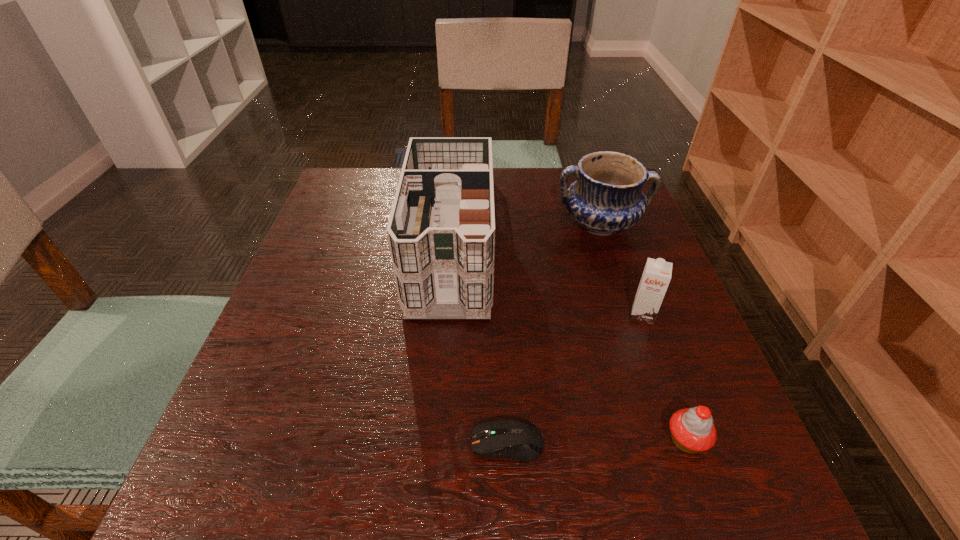
Locate an element on the screen. Image resolution: width=960 pixels, height=540 pixels. object situated at the near right corner is located at coordinates (692, 430).

Identify the location of vacant area at the far edge of the desktop. The width and height of the screenshot is (960, 540). (501, 198).

Locate an element on the screen. The height and width of the screenshot is (540, 960). vacant space at the near edge is located at coordinates (347, 498).

In the image, there is a desktop. At what (x,y) coordinates should I click in order to perform the action: click on free space at the left edge. Please return your answer as a coordinate pair (x, y). Image resolution: width=960 pixels, height=540 pixels. Looking at the image, I should click on (298, 387).

The image size is (960, 540). What are the coordinates of `vacant space at the right edge of the desktop` in the screenshot? It's located at (647, 238).

Find the location of a particular element. free space at the near left corner is located at coordinates (205, 463).

The image size is (960, 540). In the image, there is a desktop. In order to click on free region at the near right corner in this screenshot , I will do (x=724, y=482).

You are a GUI agent. You are given a task and a screenshot of the screen. Output one action in this format:
    pyautogui.click(x=<x>, y=<y>)
    Task: Click on the vacant space that's between the chocolate milk and the fourth shortest object
    
    Given the screenshot: What is the action you would take?
    pyautogui.click(x=621, y=269)

The width and height of the screenshot is (960, 540). I want to click on free spot between the chocolate milk and the pottery, so click(621, 269).

You are a GUI agent. You are given a task and a screenshot of the screen. Output one action in this format:
    pyautogui.click(x=<x>, y=<y>)
    Task: Click on the vacant point located between the computer equipment and the second shortest object
    
    Given the screenshot: What is the action you would take?
    pyautogui.click(x=597, y=442)